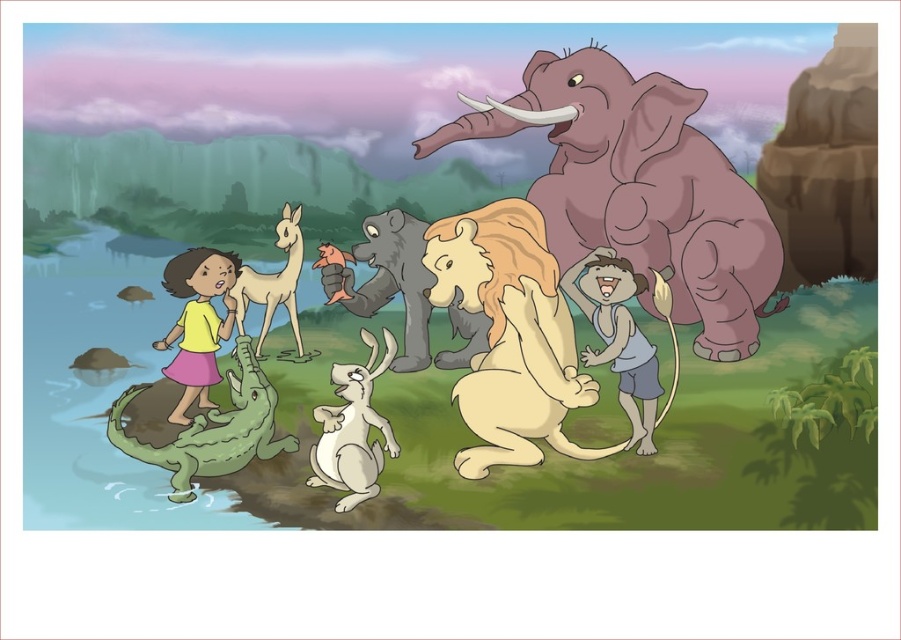
You are a photographer standing in the scene and want to take a photo of both the light brown skin at center and the yellow matte shirt at center. Which one will appear closer to you in the photo?

The light brown skin at center will appear closer to you in the photo because it is in front of the yellow matte shirt at center.